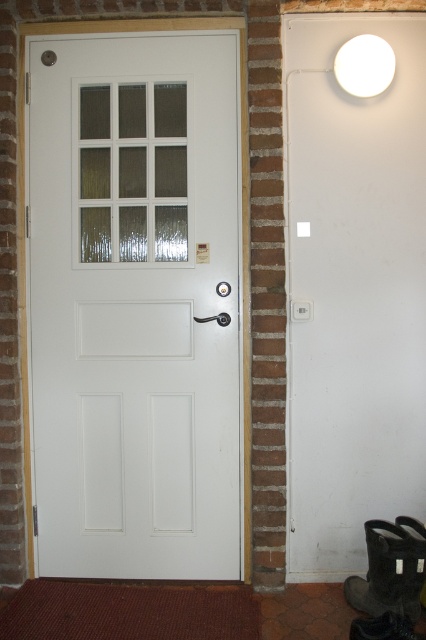
Is white matte door at center wider than white matte light fixture at upper right?

Correct, the width of white matte door at center exceeds that of white matte light fixture at upper right.

Does point (235, 96) come behind point (351, 68)?

Yes, point (235, 96) is behind point (351, 68).

Image resolution: width=426 pixels, height=640 pixels. Find the location of `white matte door at center`. white matte door at center is located at coordinates [x=135, y=305].

The image size is (426, 640). Find the location of `white matte door at center`. white matte door at center is located at coordinates (135, 305).